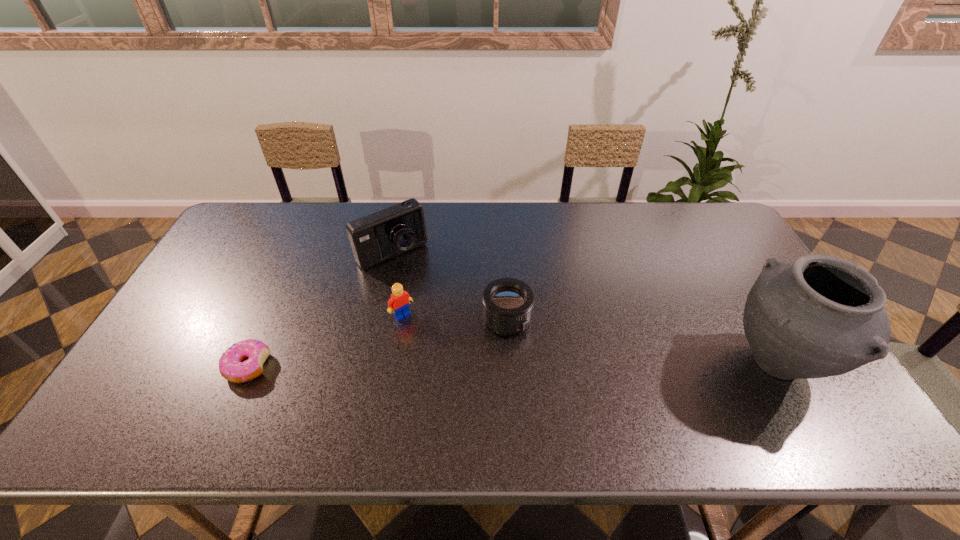
You are a GUI agent. You are given a task and a screenshot of the screen. Output one action in this format:
    pyautogui.click(x=<x>, y=<y>)
    Task: Click on the free spot on the desktop that is between the shortest object and the urn and is positioned on the front-facing side of the farthest object
    The image size is (960, 540).
    Given the screenshot: What is the action you would take?
    pyautogui.click(x=477, y=365)

Locate an element on the screen. This screenshot has height=540, width=960. vacant space on the desktop that is between the shortest object and the tallest object and is positioned on the side of the fourth tallest object with brand markings and control switches is located at coordinates (577, 364).

Identify the location of free space on the desktop that is between the leftmost object and the tallest object and is positioned on the face of the Lego. (446, 365).